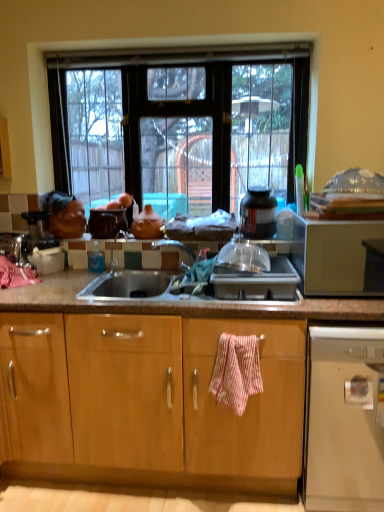
Question: Should I look upward or downward to see matte clay pot at center?

Choices:
 (A) down
 (B) up

Answer: (B)

Question: Can you confirm if transparent glass window at center is smaller than pink striped towel at center?

Choices:
 (A) yes
 (B) no

Answer: (B)

Question: Is transparent glass window at center to the left of pink striped towel at center from the viewer's perspective?

Choices:
 (A) yes
 (B) no

Answer: (A)

Question: Does transparent glass window at center have a larger size compared to pink striped towel at center?

Choices:
 (A) no
 (B) yes

Answer: (B)

Question: From the image's perspective, is transparent glass window at center located beneath pink striped towel at center?

Choices:
 (A) no
 (B) yes

Answer: (A)

Question: From a real-world perspective, is transparent glass window at center located higher than pink striped towel at center?

Choices:
 (A) no
 (B) yes

Answer: (B)

Question: Is transparent glass window at center directly adjacent to pink striped towel at center?

Choices:
 (A) yes
 (B) no

Answer: (B)

Question: Is satin gold microwave at right to the left of matte clay pot at center from the viewer's perspective?

Choices:
 (A) no
 (B) yes

Answer: (A)

Question: Is satin gold microwave at right further to camera compared to matte clay pot at center?

Choices:
 (A) no
 (B) yes

Answer: (A)

Question: Is matte clay pot at center a part of satin gold microwave at right?

Choices:
 (A) no
 (B) yes

Answer: (A)

Question: Is satin gold microwave at right shorter than matte clay pot at center?

Choices:
 (A) yes
 (B) no

Answer: (B)

Question: Can you confirm if satin gold microwave at right is positioned to the right of matte clay pot at center?

Choices:
 (A) yes
 (B) no

Answer: (A)

Question: Is satin gold microwave at right taller than matte clay pot at center?

Choices:
 (A) no
 (B) yes

Answer: (B)

Question: Is satin gold microwave at right closer to camera compared to satin silver gas stove at center?

Choices:
 (A) yes
 (B) no

Answer: (A)